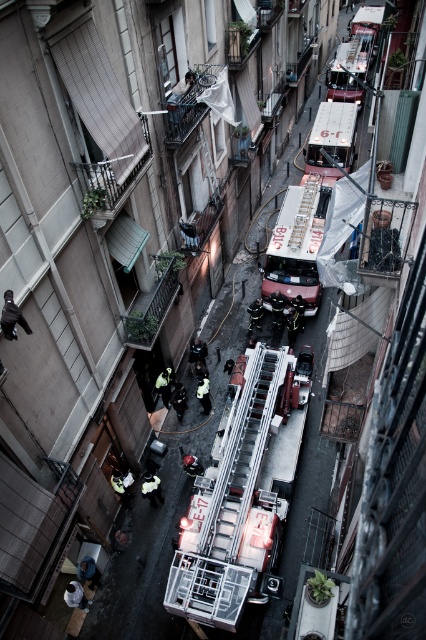
You are a firefighter trying to exit the alley quickly. You need to move from the metallic silver ladder at center to the metallic silver fire truck at center. Is the ladder above or below the fire truck?

The metallic silver fire truck at center is positioned under the metallic silver ladder at center, so the ladder is above the fire truck.

You are an emergency responder trying to navigate through the narrow alley. You see the metallic silver fire truck at center and the metallic red fire truck at center. Which fire truck is positioned closer to the left side of the alley?

The metallic silver fire truck at center is positioned closer to the left side of the alley since it is to the left of the metallic red fire truck at center.